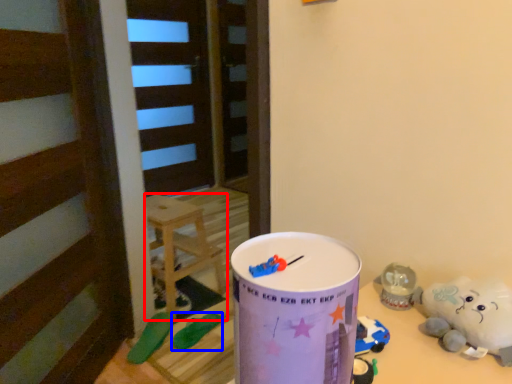
Question: Which of the following is the closest to the observer, furniture (highlighted by a red box) or toy (highlighted by a blue box)?

Choices:
 (A) furniture
 (B) toy

Answer: (B)